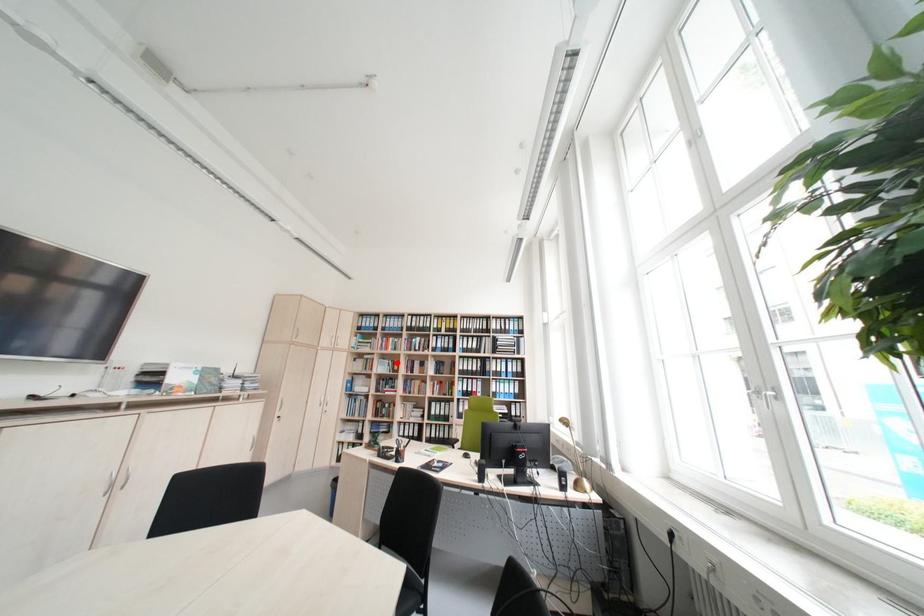
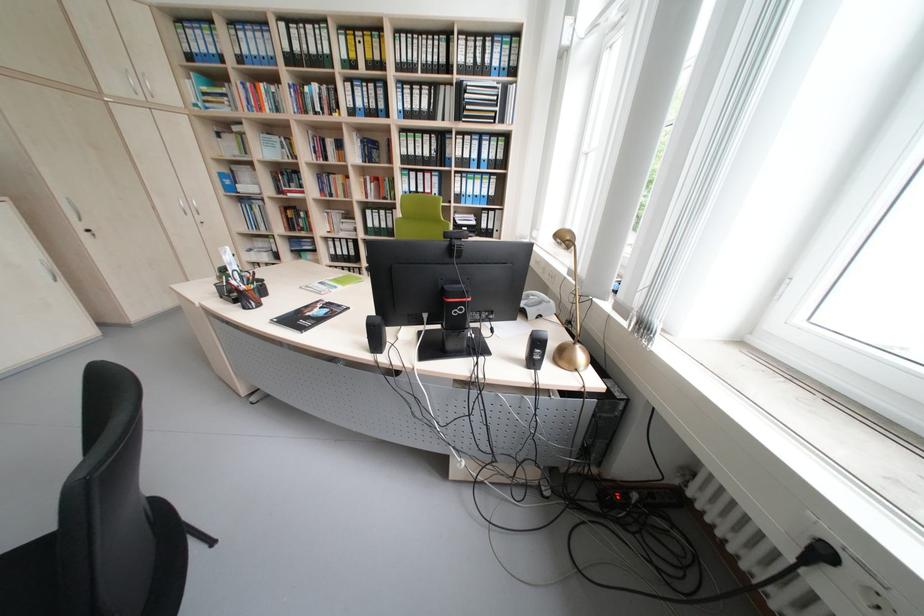
Question: I am providing you with two images of the same scene from different viewpoints. In image1, a red point is highlighted. Considering the same 3D point in image2, which of the following is correct?

Choices:
 (A) It is closer
 (B) It is farther

Answer: (A)